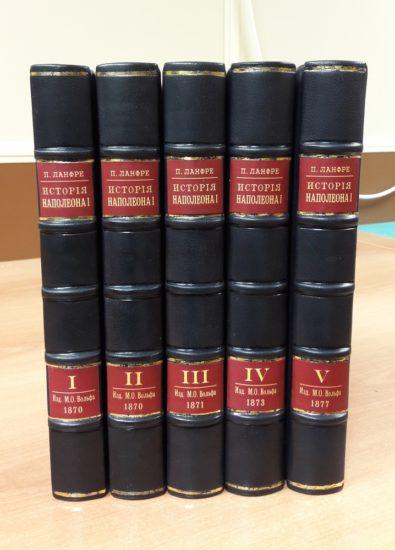
Locate an element on the screen. The height and width of the screenshot is (550, 395). books is located at coordinates (75, 286), (134, 287), (204, 292), (264, 289), (316, 291).